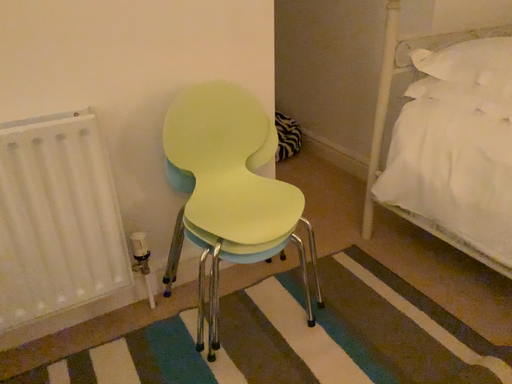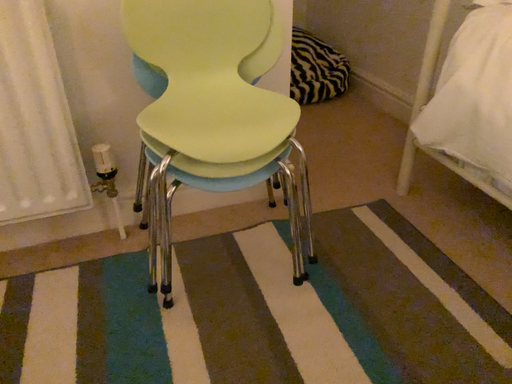
Question: How did the camera likely rotate when shooting the video?

Choices:
 (A) rotated right
 (B) rotated left

Answer: (B)